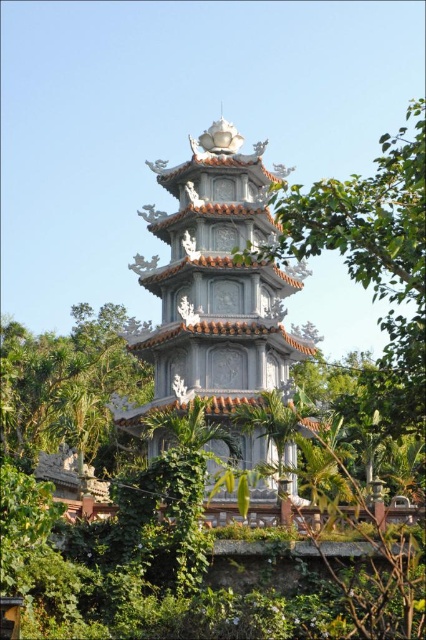
Does green leafy tree at center come in front of green leafy tree at left?

Yes, it is in front of green leafy tree at left.

Can you confirm if green leafy tree at center is thinner than green leafy tree at left?

No, green leafy tree at center is not thinner than green leafy tree at left.

Where is `green leafy tree at center`? green leafy tree at center is located at coordinates click(x=371, y=256).

Is white stone pagoda at center to the left of green leafy tree at left from the viewer's perspective?

Incorrect, white stone pagoda at center is not on the left side of green leafy tree at left.

Can you confirm if white stone pagoda at center is shorter than green leafy tree at left?

No, white stone pagoda at center is not shorter than green leafy tree at left.

This screenshot has height=640, width=426. Describe the element at coordinates (213, 284) in the screenshot. I see `white stone pagoda at center` at that location.

This screenshot has width=426, height=640. I want to click on white stone pagoda at center, so pos(213,284).

Who is higher up, white stone pagoda at center or green leafy tree at center?

green leafy tree at center is above.

Where is `white stone pagoda at center`? white stone pagoda at center is located at coordinates pyautogui.click(x=213, y=284).

You are a GUI agent. You are given a task and a screenshot of the screen. Output one action in this format:
    pyautogui.click(x=<x>, y=<y>)
    Task: Click on the white stone pagoda at center
    The height and width of the screenshot is (640, 426).
    Given the screenshot: What is the action you would take?
    pyautogui.click(x=213, y=284)